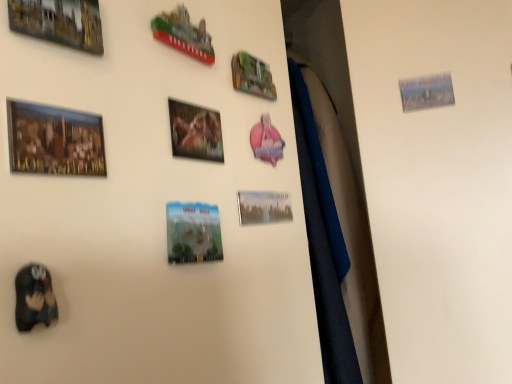
Question: Considering the relative sizes of metallic green sign at upper center, placed as the third picture frame when sorted from right to left, and matte wooden picture frame at upper left, which appears as the seventh picture frame when viewed from the right, in the image provided, is metallic green sign at upper center, placed as the third picture frame when sorted from right to left, shorter than matte wooden picture frame at upper left, which appears as the seventh picture frame when viewed from the right,?

Choices:
 (A) yes
 (B) no

Answer: (B)

Question: Is matte wooden picture frame at upper left, positioned as the 2th picture frame in left-to-right order, a part of metallic green sign at upper center, marked as the 6th picture frame in a left-to-right arrangement?

Choices:
 (A) no
 (B) yes

Answer: (A)

Question: From a real-world perspective, is metallic green sign at upper center, marked as the 6th picture frame in a left-to-right arrangement, on top of matte wooden picture frame at upper left, which appears as the seventh picture frame when viewed from the right?

Choices:
 (A) no
 (B) yes

Answer: (B)

Question: Can you confirm if metallic green sign at upper center, placed as the third picture frame when sorted from right to left, is wider than matte wooden picture frame at upper left, which appears as the seventh picture frame when viewed from the right?

Choices:
 (A) yes
 (B) no

Answer: (A)

Question: Considering the relative positions of metallic green sign at upper center, placed as the third picture frame when sorted from right to left, and matte wooden picture frame at upper left, positioned as the 2th picture frame in left-to-right order, in the image provided, is metallic green sign at upper center, placed as the third picture frame when sorted from right to left, behind matte wooden picture frame at upper left, positioned as the 2th picture frame in left-to-right order,?

Choices:
 (A) yes
 (B) no

Answer: (A)

Question: Can you confirm if metallic green sign at upper center, marked as the 6th picture frame in a left-to-right arrangement, is positioned to the left of matte wooden picture frame at upper left, positioned as the 2th picture frame in left-to-right order?

Choices:
 (A) no
 (B) yes

Answer: (A)

Question: From the image's perspective, would you say matte plastic magnet at center, marked as the 4th picture frame in a right-to-left arrangement, is shown under metallic green sign at upper center, marked as the 6th picture frame in a left-to-right arrangement?

Choices:
 (A) no
 (B) yes

Answer: (B)

Question: From the image's perspective, is matte plastic magnet at center, marked as the 4th picture frame in a right-to-left arrangement, over metallic green sign at upper center, placed as the third picture frame when sorted from right to left?

Choices:
 (A) no
 (B) yes

Answer: (A)

Question: Does matte plastic magnet at center, the 5th picture frame from the left, appear on the right side of metallic green sign at upper center, placed as the third picture frame when sorted from right to left?

Choices:
 (A) no
 (B) yes

Answer: (A)

Question: Is the position of matte plastic magnet at center, the 5th picture frame from the left, less distant than that of metallic green sign at upper center, placed as the third picture frame when sorted from right to left?

Choices:
 (A) no
 (B) yes

Answer: (B)

Question: Does matte plastic magnet at center, the 5th picture frame from the left, lie behind metallic green sign at upper center, placed as the third picture frame when sorted from right to left?

Choices:
 (A) yes
 (B) no

Answer: (B)

Question: From a real-world perspective, is matte plastic magnet at center, marked as the 4th picture frame in a right-to-left arrangement, beneath metallic green sign at upper center, placed as the third picture frame when sorted from right to left?

Choices:
 (A) no
 (B) yes

Answer: (B)

Question: Is there a large distance between gold metallic picture frame at upper left, the 8th picture frame when ordered from right to left, and matte wooden picture frame at upper left, which appears as the seventh picture frame when viewed from the right?

Choices:
 (A) yes
 (B) no

Answer: (B)